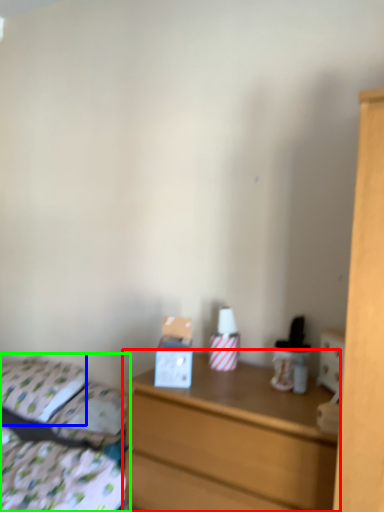
Question: Which object is the farthest from chest of drawers (highlighted by a red box)? Choose among these: pillow (highlighted by a blue box) or bed (highlighted by a green box).

Choices:
 (A) pillow
 (B) bed

Answer: (A)